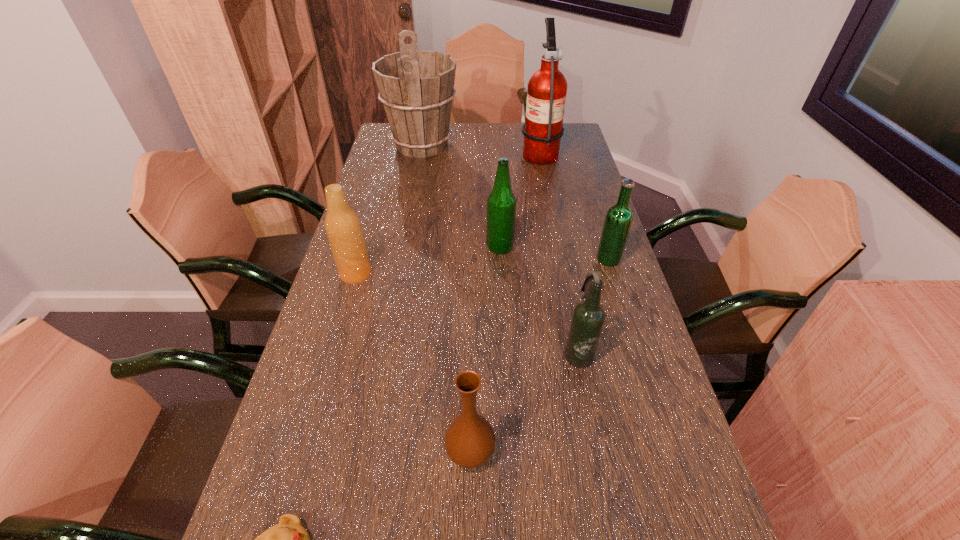
The height and width of the screenshot is (540, 960). I want to click on bucket located at the far edge, so click(x=416, y=87).

The width and height of the screenshot is (960, 540). Identify the location of bucket present at the left edge. (416, 87).

Identify the location of beer bottle located in the left edge section of the desktop. (343, 228).

Identify the location of fire extinguisher located at the right edge. This screenshot has height=540, width=960. (546, 95).

This screenshot has width=960, height=540. I want to click on object located in the far left corner section of the desktop, so click(x=416, y=87).

The image size is (960, 540). In order to click on object that is at the far right corner in this screenshot , I will do `click(546, 95)`.

Where is `free region at the far edge of the desktop`? free region at the far edge of the desktop is located at coordinates (459, 137).

Locate an element on the screen. This screenshot has height=540, width=960. free space at the left edge of the desktop is located at coordinates (398, 204).

Locate an element on the screen. This screenshot has width=960, height=540. free space at the right edge of the desktop is located at coordinates (631, 410).

The image size is (960, 540). Find the location of `free space between the fire extinguisher and the seventh farthest object`. free space between the fire extinguisher and the seventh farthest object is located at coordinates click(505, 302).